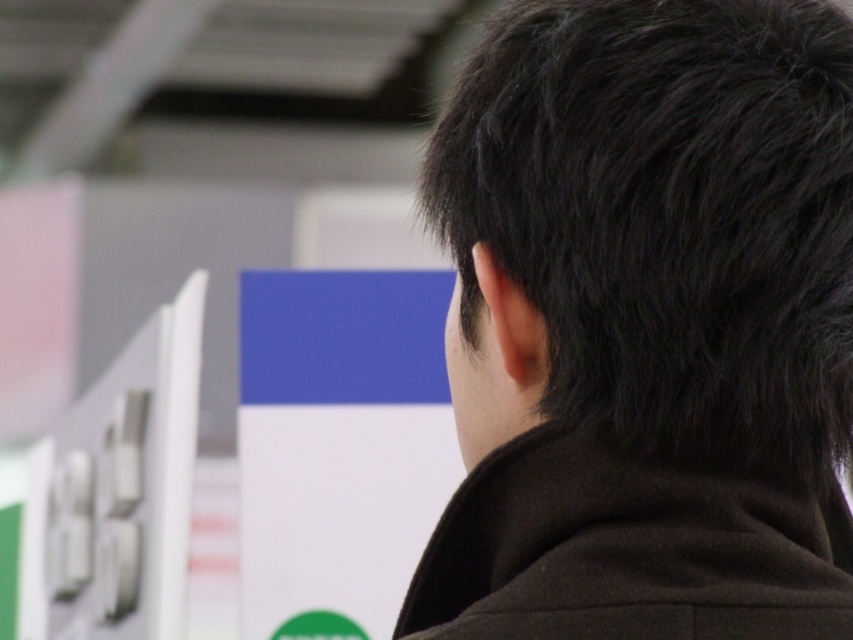
Question: Which object is closer to the camera taking this photo?

Choices:
 (A) black matte hair at upper right
 (B) black matte jacket at center

Answer: (B)

Question: Can you confirm if black matte hair at upper right is positioned below black matte jacket at center?

Choices:
 (A) yes
 (B) no

Answer: (B)

Question: Does black matte hair at upper right appear on the right side of black matte jacket at center?

Choices:
 (A) no
 (B) yes

Answer: (A)

Question: Can you confirm if black matte hair at upper right is bigger than black matte jacket at center?

Choices:
 (A) yes
 (B) no

Answer: (A)

Question: Which point is farther to the camera?

Choices:
 (A) black matte hair at upper right
 (B) black matte jacket at center

Answer: (A)